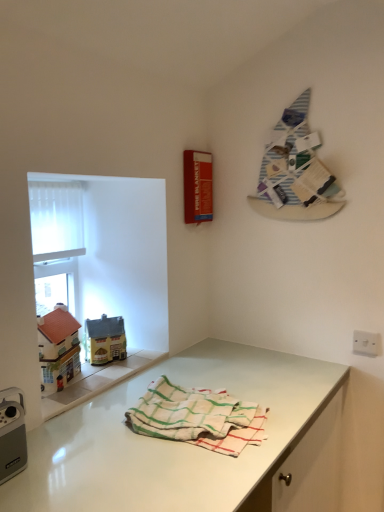
At what (x,y) coordinates should I click in order to perform the action: click on free space in front of white woven towel at center. Please return your answer as a coordinate pair (x, y). The height and width of the screenshot is (512, 384). Looking at the image, I should click on (178, 483).